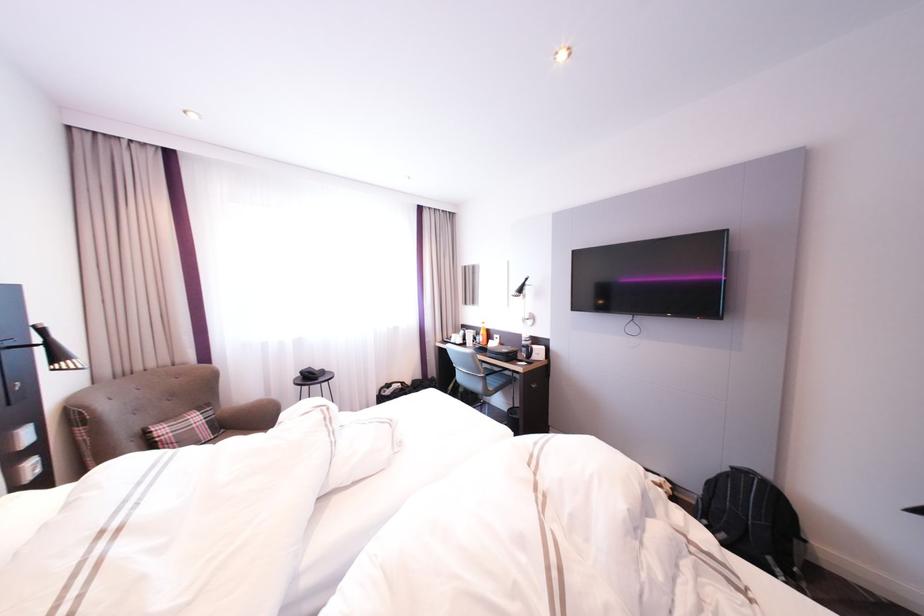
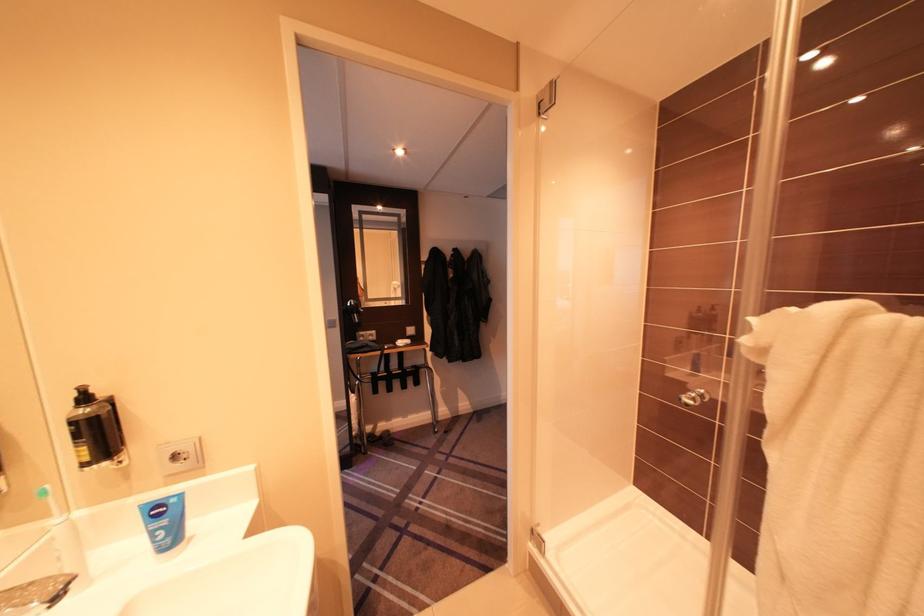
Question: I am providing you with two images of the same scene from different viewpoints. Please identify which objects are invisible in image2.

Choices:
 (A) blue nivea tube
 (B) black hairdryer
 (C) toy maze bead
 (D) black backpack

Answer: (D)